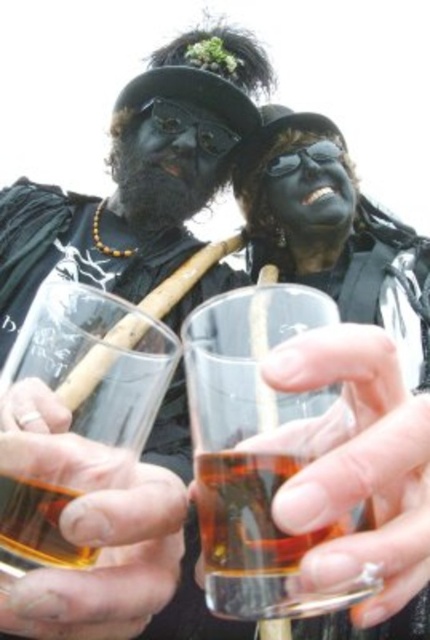
Between transparent glass at center and translucent glass at center, which one appears on the left side from the viewer's perspective?

Positioned to the left is transparent glass at center.

Is point (89, 616) in front of point (381, 493)?

No, (89, 616) is further to viewer.

I want to click on transparent glass at center, so click(x=135, y=179).

Is transparent glass at center to the left of black matte mask at center from the viewer's perspective?

Yes, transparent glass at center is to the left of black matte mask at center.

Find the location of a particular element. transparent glass at center is located at coordinates (135, 179).

Who is lower down, translucent plastic shot glass at center or black matte face at center?

Positioned lower is translucent plastic shot glass at center.

Is translucent plastic shot glass at center taller than black matte face at center?

In fact, translucent plastic shot glass at center may be shorter than black matte face at center.

Who is more distant from viewer, [107,310] or [301,180]?

Point [301,180]

The width and height of the screenshot is (430, 640). What are the coordinates of `translucent plastic shot glass at center` in the screenshot? It's located at [89, 394].